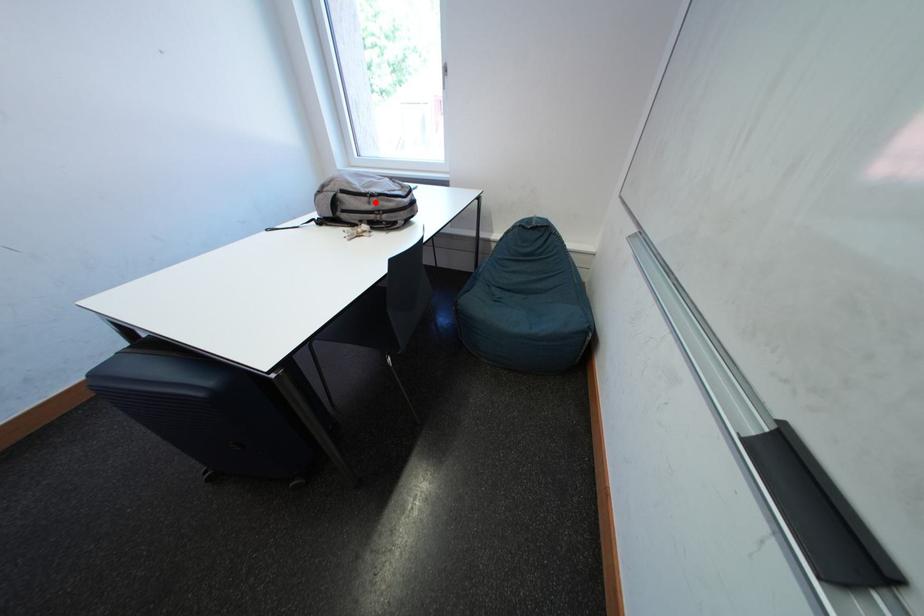
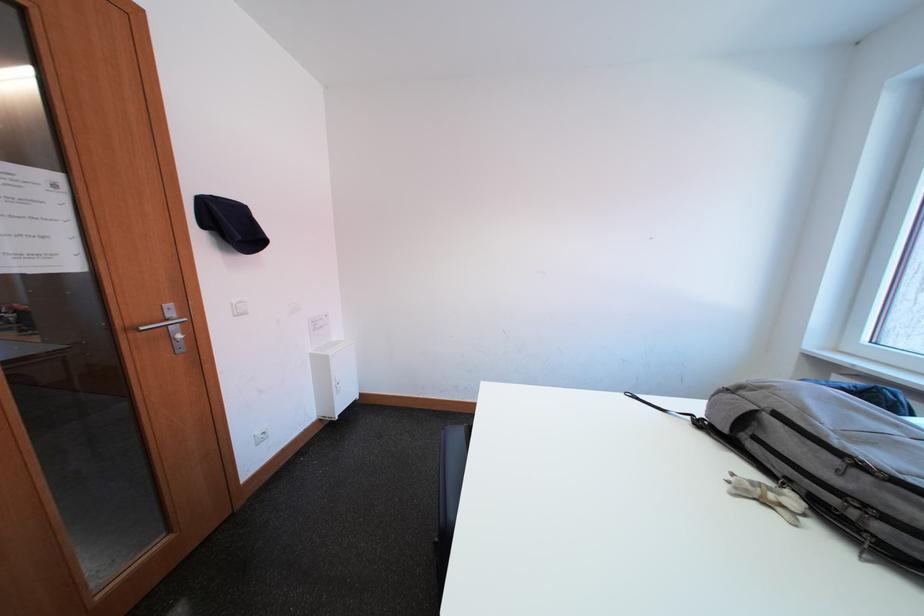
The point at the highlighted location is marked in the first image. Where is the corresponding point in the second image?

(844, 464)